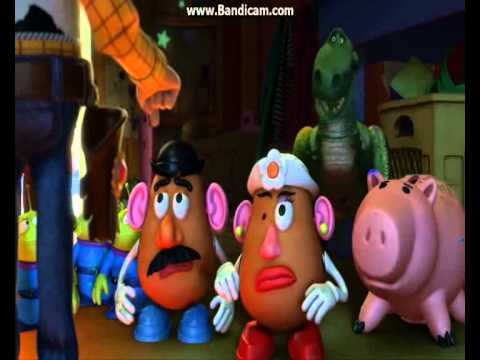
The image size is (480, 360). What are the coordinates of `floor` in the screenshot? It's located at (105, 335), (397, 341).